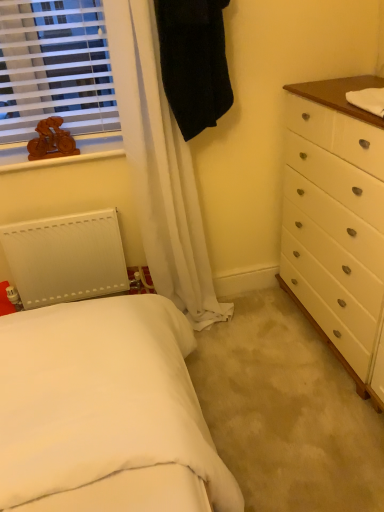
The height and width of the screenshot is (512, 384). Find the location of `vacant space underneath black fabric robe at upper center (from a real-world perspective)`. vacant space underneath black fabric robe at upper center (from a real-world perspective) is located at coordinates click(223, 316).